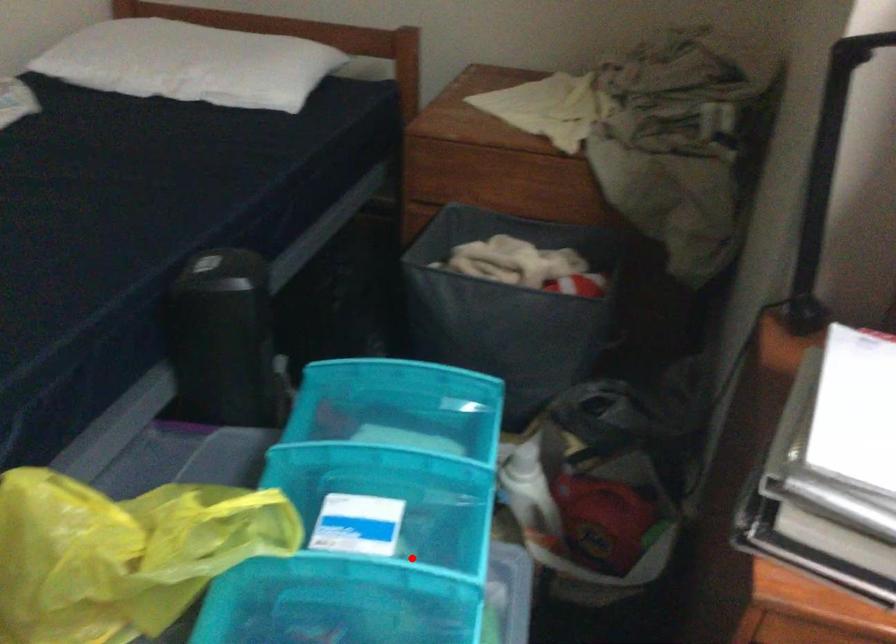
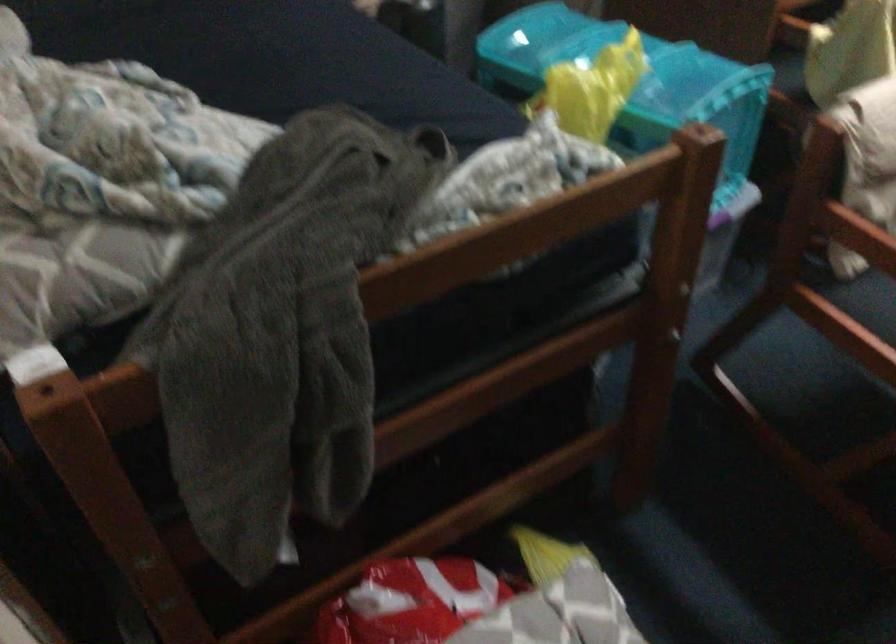
Question: I am providing you with two images of the same scene from different viewpoints. A red point is marked on the first image. Is the red point's position out of view in image 2?

Choices:
 (A) Yes
 (B) No

Answer: (A)